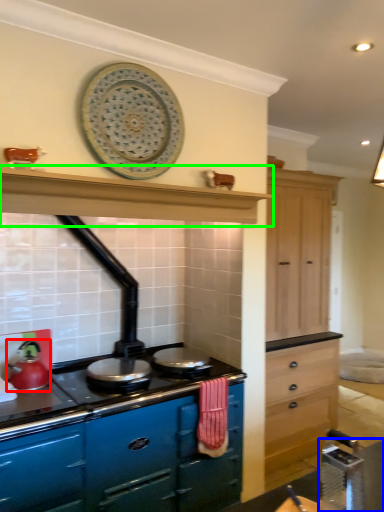
Question: Which object is positioned farthest from kitchen appliance (highlighted by a red box)? Select from table (highlighted by a blue box) and exhaust hood (highlighted by a green box).

Choices:
 (A) table
 (B) exhaust hood

Answer: (A)